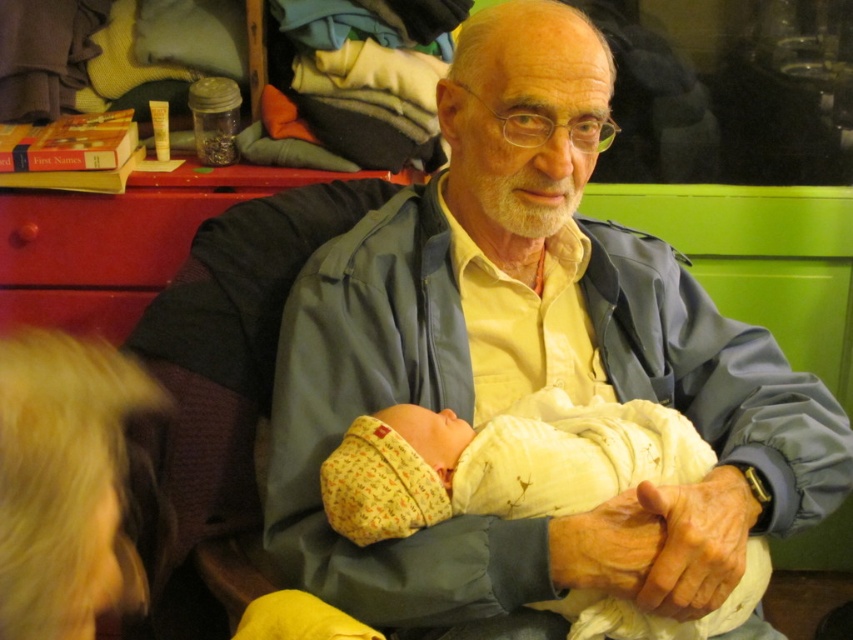
Question: Is the position of matte blue jacket at center less distant than that of red wood drawer at left?

Choices:
 (A) no
 (B) yes

Answer: (B)

Question: Does matte blue jacket at center appear under red wood drawer at left?

Choices:
 (A) no
 (B) yes

Answer: (B)

Question: Which is nearer to the red wood drawer at left?

Choices:
 (A) matte blue jacket at center
 (B) yellow cotton swaddle at center

Answer: (A)

Question: Which of the following is the closest to the observer?

Choices:
 (A) red wood drawer at left
 (B) yellow cotton swaddle at center
 (C) matte blue jacket at center

Answer: (C)

Question: Considering the relative positions of matte blue jacket at center and red wood drawer at left in the image provided, where is matte blue jacket at center located with respect to red wood drawer at left?

Choices:
 (A) below
 (B) above

Answer: (A)

Question: Which of these objects is positioned closest to the matte blue jacket at center?

Choices:
 (A) yellow cotton swaddle at center
 (B) red wood drawer at left

Answer: (A)